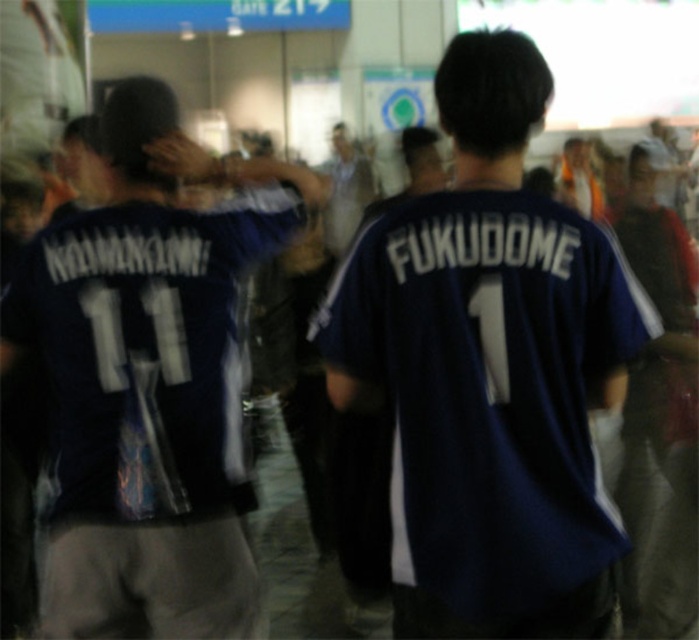
You are organizing a team photo and need to ensure all jerseys are visible. Given that the dark blue jersey at center and the matte blue jersey at center are both in the frame, which one might be harder to see due to its size?

The dark blue jersey at center occupies less space than the matte blue jersey at center, so it might be harder to see due to its smaller size.

You are standing in the hallway where the sports jersey event is happening. You notice two points marked in the scene. The first point is at coordinate point (500, 230) and the second is at point (333, 243). Which point is closer to you?

Point (500, 230) is closer to the camera than point (333, 243), so the first point is closer to you.

You are a photographer adjusting the camera height to frame both the dark blue jersey at center and the matte blue jersey at center in the shot. Which jersey should you position the camera lower to focus on?

The dark blue jersey at center is not as tall as the matte blue jersey at center, so you should position the camera lower to focus on the matte blue jersey at center to capture its full height.